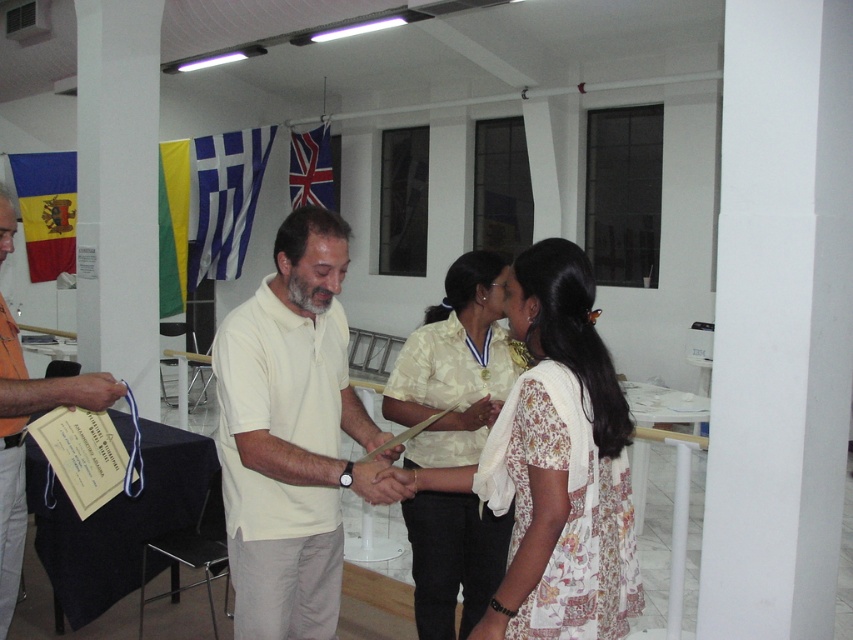
Question: Which point is closer to the camera taking this photo?

Choices:
 (A) (343, 248)
 (B) (318, 132)
 (C) (67, 220)
 (D) (181, 244)

Answer: (A)

Question: Is white floral dress at center to the right of orange fabric shirt at left from the viewer's perspective?

Choices:
 (A) no
 (B) yes

Answer: (B)

Question: Which of the following is the farthest from the observer?

Choices:
 (A) blue and yellow fabric flag at left
 (B) white floral dress at center
 (C) blue fabric flag at upper left
 (D) orange fabric shirt at left

Answer: (C)

Question: Based on their relative distances, which object is nearer to the union jack fabric flag at upper center?

Choices:
 (A) white matte shirt at center
 (B) blue fabric flag at upper left
 (C) white floral dress at center
 (D) orange fabric shirt at left

Answer: (B)

Question: Does orange fabric shirt at left appear under union jack fabric flag at upper center?

Choices:
 (A) yes
 (B) no

Answer: (A)

Question: In this image, where is white floral dress at center located relative to blue and yellow fabric flag at left?

Choices:
 (A) left
 (B) right

Answer: (B)